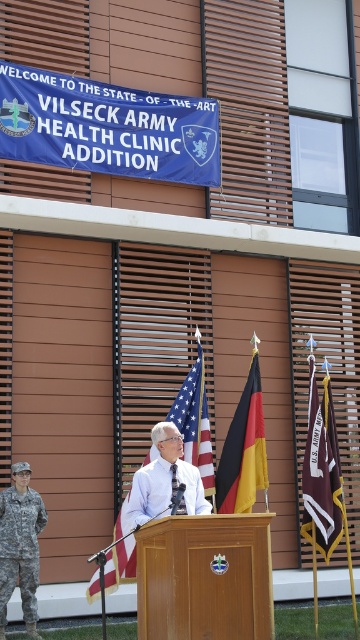
Question: Which of the following is the farthest from the observer?

Choices:
 (A) american flag at center
 (B) white cotton shirt at center
 (C) camouflage fabric uniform at left
 (D) black/yellow/red fabric flag at center

Answer: (A)

Question: Can you confirm if american flag at center is wider than white cotton shirt at center?

Choices:
 (A) yes
 (B) no

Answer: (B)

Question: Is american flag at center positioned before camouflage fabric uniform at left?

Choices:
 (A) yes
 (B) no

Answer: (B)

Question: Which of the following is the farthest from the observer?

Choices:
 (A) (140, 497)
 (B) (326, 497)
 (C) (120, 506)
 (D) (1, 532)

Answer: (C)

Question: Among these points, which one is nearest to the camera?

Choices:
 (A) (128, 508)
 (B) (254, 456)
 (C) (195, 417)
 (D) (326, 552)

Answer: (A)

Question: Does american flag at center have a smaller size compared to white cotton shirt at center?

Choices:
 (A) yes
 (B) no

Answer: (B)